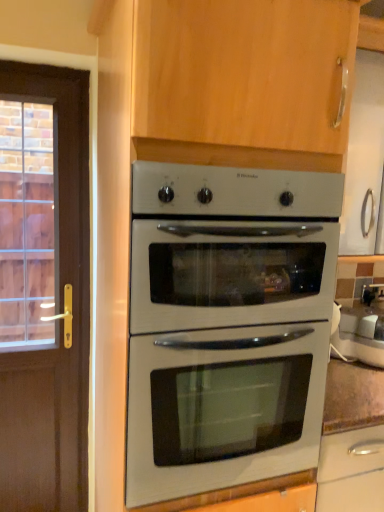
The image size is (384, 512). What are the coordinates of `white glossy oven at center` in the screenshot? It's located at (227, 325).

The image size is (384, 512). What do you see at coordinates (227, 325) in the screenshot?
I see `white glossy oven at center` at bounding box center [227, 325].

Measure the distance between point (x=272, y=282) and camera.

The distance of point (x=272, y=282) from camera is 1.19 meters.

What do you see at coordinates (360, 330) in the screenshot? Image resolution: width=384 pixels, height=512 pixels. I see `white glossy kettle at right` at bounding box center [360, 330].

Identify the location of white glossy kettle at right. (360, 330).

You are a GUI agent. You are given a task and a screenshot of the screen. Output one action in this format:
    pyautogui.click(x=<x>, y=<y>)
    Task: Click on the white glossy oven at center
    
    Given the screenshot: What is the action you would take?
    pyautogui.click(x=227, y=325)

Considering the positions of objects white glossy oven at center and white glossy kettle at right in the image provided, who is more to the left, white glossy oven at center or white glossy kettle at right?

Positioned to the left is white glossy oven at center.

Which is behind, white glossy oven at center or white glossy kettle at right?

white glossy kettle at right.

Which point is more forward, (216, 238) or (376, 320)?

The point (216, 238) is closer.

From the image's perspective, is white glossy oven at center positioned above or below white glossy kettle at right?

From the image's perspective, white glossy oven at center appears above white glossy kettle at right.

From a real-world perspective, which is physically below, white glossy oven at center or white glossy kettle at right?

From a 3D spatial view, white glossy kettle at right is below.

Based on the photo, can you confirm if white glossy oven at center is wider than white glossy kettle at right?

Indeed, white glossy oven at center has a greater width compared to white glossy kettle at right.

Considering the relative sizes of white glossy oven at center and white glossy kettle at right in the image provided, is white glossy oven at center shorter than white glossy kettle at right?

Incorrect, the height of white glossy oven at center does not fall short of that of white glossy kettle at right.

Between white glossy oven at center and white glossy kettle at right, which one has larger size?

Bigger between the two is white glossy oven at center.

Is white glossy oven at center not within white glossy kettle at right?

Yes, white glossy oven at center is outside of white glossy kettle at right.

Is white glossy oven at center not close to white glossy kettle at right?

Actually, white glossy oven at center and white glossy kettle at right are a little close together.

Does white glossy oven at center turn towards white glossy kettle at right?

No.

From the picture: Can you tell me how much white glossy oven at center and white glossy kettle at right differ in facing direction?

white glossy oven at center and white glossy kettle at right are facing 0.356 degrees away from each other.

At what (x,y) coordinates should I click in order to perform the action: click on appliance located below the white glossy oven at center (from the image's perspective). Please return your answer as a coordinate pair (x, y). Looking at the image, I should click on click(x=360, y=330).

Would you say white glossy kettle at right is to the left or to the right of white glossy oven at center in the picture?

white glossy kettle at right is positioned on white glossy oven at center's right side.

Considering the positions of objects white glossy kettle at right and white glossy oven at center in the image provided, who is behind, white glossy kettle at right or white glossy oven at center?

white glossy kettle at right is further away from the camera.

Which is behind, point (343, 353) or point (162, 487)?

The point (343, 353) is farther.

Looking at this image, from the image's perspective, which one is positioned lower, white glossy kettle at right or white glossy oven at center?

From the image's view, white glossy kettle at right is below.

From a real-world perspective, which is physically above, white glossy kettle at right or white glossy oven at center?

In real-world perspective, white glossy oven at center is above.

Which object is wider, white glossy kettle at right or white glossy oven at center?

white glossy oven at center is wider.

Consider the image. Is white glossy kettle at right taller than white glossy oven at center?

No, white glossy kettle at right is not taller than white glossy oven at center.

Looking at this image, considering the relative sizes of white glossy kettle at right and white glossy oven at center in the image provided, is white glossy kettle at right smaller than white glossy oven at center?

Yes, white glossy kettle at right is smaller than white glossy oven at center.

Is white glossy kettle at right outside of white glossy oven at center?

white glossy kettle at right is positioned outside white glossy oven at center.

Would you consider white glossy kettle at right to be distant from white glossy oven at center?

They are positioned close to each other.

Could you tell me if white glossy kettle at right is turned towards white glossy oven at center?

No, white glossy kettle at right does not turn towards white glossy oven at center.

You are a GUI agent. You are given a task and a screenshot of the screen. Output one action in this format:
    pyautogui.click(x=<x>, y=<y>)
    Task: Click on the appliance below the white glossy oven at center (from a real-world perspective)
    Image resolution: width=384 pixels, height=512 pixels.
    Given the screenshot: What is the action you would take?
    pyautogui.click(x=360, y=330)

This screenshot has width=384, height=512. Identify the location of appliance located on the right of white glossy oven at center. (360, 330).

I want to click on appliance below the white glossy oven at center (from a real-world perspective), so click(360, 330).